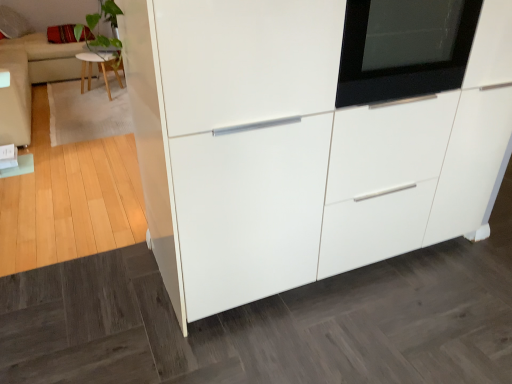
Question: Is light wood stool at upper left not inside white glossy cabinet at center?

Choices:
 (A) no
 (B) yes

Answer: (B)

Question: Can you confirm if light wood stool at upper left is shorter than white glossy cabinet at center?

Choices:
 (A) no
 (B) yes

Answer: (B)

Question: Is light wood stool at upper left placed right next to white glossy cabinet at center?

Choices:
 (A) no
 (B) yes

Answer: (A)

Question: Does light wood stool at upper left contain white glossy cabinet at center?

Choices:
 (A) no
 (B) yes

Answer: (A)

Question: Would you consider light wood stool at upper left to be distant from white glossy cabinet at center?

Choices:
 (A) no
 (B) yes

Answer: (B)

Question: Can you confirm if light wood stool at upper left is wider than white glossy cabinet at center?

Choices:
 (A) yes
 (B) no

Answer: (B)

Question: Can we say beige fabric couch at upper left, the second couch in the right-to-left sequence, lies outside velvet red pillow at upper left?

Choices:
 (A) no
 (B) yes

Answer: (B)

Question: Considering the relative sizes of beige fabric couch at upper left, which appears as the second couch when viewed from the front, and velvet red pillow at upper left in the image provided, is beige fabric couch at upper left, which appears as the second couch when viewed from the front, shorter than velvet red pillow at upper left?

Choices:
 (A) yes
 (B) no

Answer: (B)

Question: Is beige fabric couch at upper left, which is counted as the 1th couch, starting from the left, oriented towards velvet red pillow at upper left?

Choices:
 (A) yes
 (B) no

Answer: (A)

Question: Considering the relative sizes of beige fabric couch at upper left, which appears as the second couch when viewed from the front, and velvet red pillow at upper left in the image provided, is beige fabric couch at upper left, which appears as the second couch when viewed from the front, smaller than velvet red pillow at upper left?

Choices:
 (A) yes
 (B) no

Answer: (B)

Question: Is beige fabric couch at upper left, which appears as the second couch when viewed from the front, taller than velvet red pillow at upper left?

Choices:
 (A) yes
 (B) no

Answer: (A)

Question: From a real-world perspective, is beige fabric couch at upper left, which is counted as the 1th couch, starting from the left, physically above velvet red pillow at upper left?

Choices:
 (A) yes
 (B) no

Answer: (B)

Question: From a real-world perspective, does black glass oven at upper right stand above velvet red pillow at upper left?

Choices:
 (A) yes
 (B) no

Answer: (A)